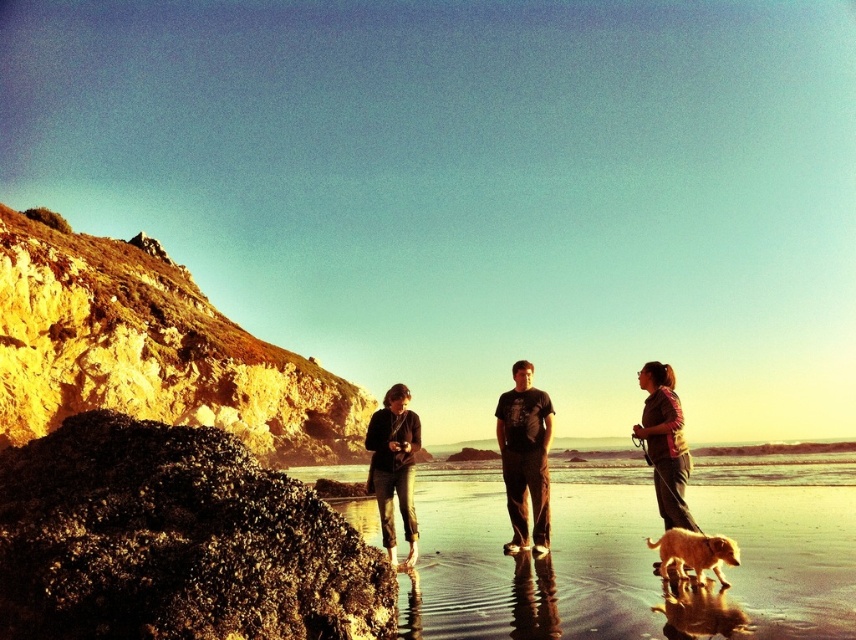
Question: Is smooth sand beach at center closer to the viewer compared to dark gray sweater at center?

Choices:
 (A) yes
 (B) no

Answer: (A)

Question: Which point is closer to the camera taking this photo?

Choices:
 (A) (407, 500)
 (B) (649, 419)
 (C) (563, 544)
 (D) (732, 545)

Answer: (D)

Question: Is the position of black cotton t-shirt at center less distant than that of dark gray sweater at center?

Choices:
 (A) yes
 (B) no

Answer: (B)

Question: Which point is closer to the camera taking this photo?

Choices:
 (A) (682, 554)
 (B) (409, 604)
 (C) (660, 374)

Answer: (B)

Question: Is black cotton t-shirt at center behind golden fur dog at lower right?

Choices:
 (A) yes
 (B) no

Answer: (A)

Question: Which object appears closest to the camera in this image?

Choices:
 (A) golden fur dog at lower right
 (B) black cotton t-shirt at center

Answer: (A)